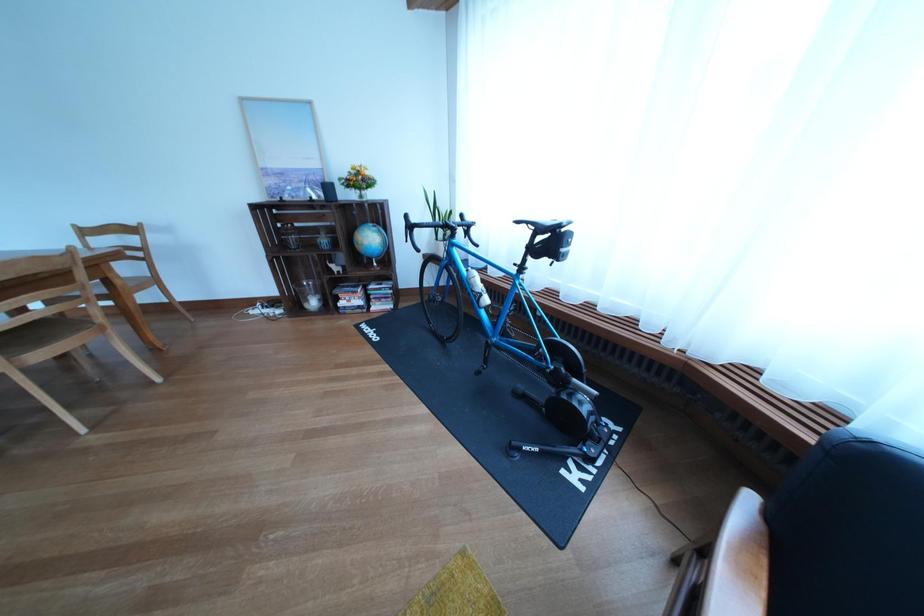
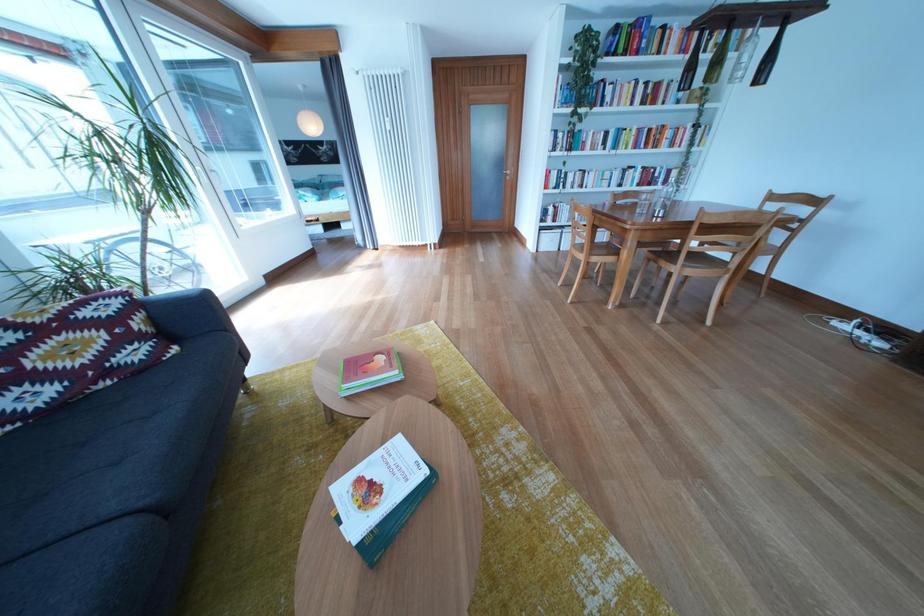
The first image is from the beginning of the video and the second image is from the end. How did the camera likely rotate when shooting the video?

The camera's rotation is toward left-down.